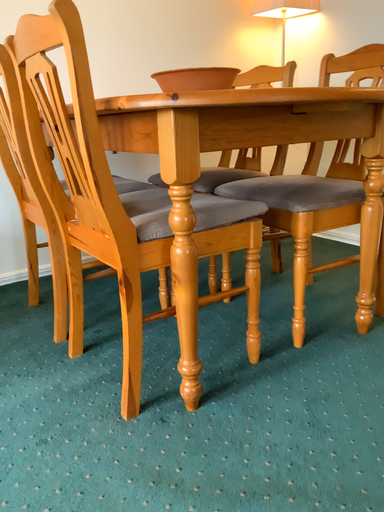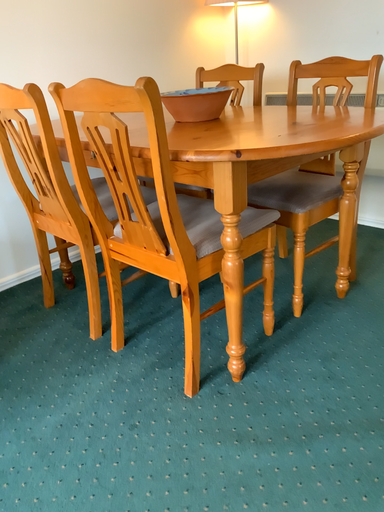
Question: How did the camera likely rotate when shooting the video?

Choices:
 (A) rotated left
 (B) rotated right

Answer: (B)